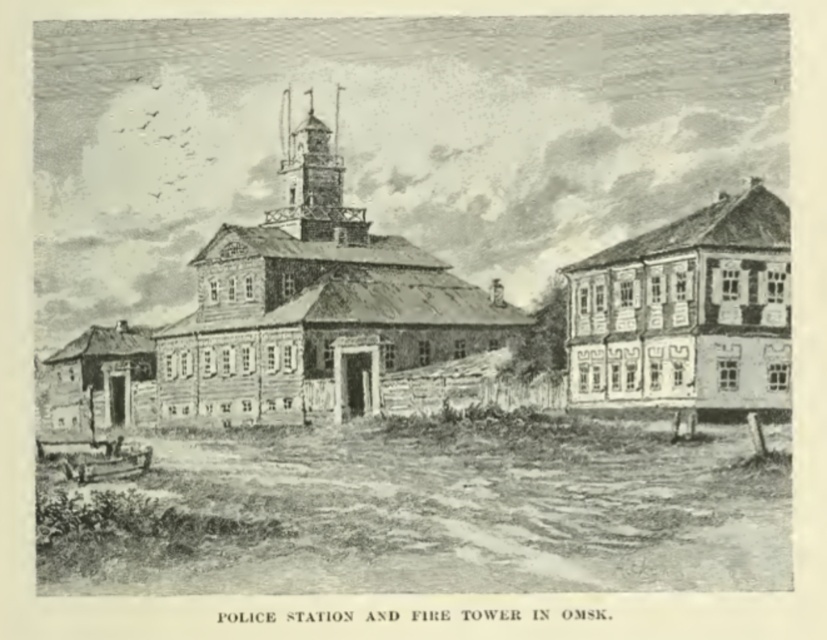
Who is taller, wooden tower at center or wooden house at right?

Standing taller between the two is wooden tower at center.

Is wooden tower at center wider than wooden house at right?

Correct, the width of wooden tower at center exceeds that of wooden house at right.

Who is more forward, (290, 168) or (708, 340)?

Point (708, 340) is in front.

At what (x,y) coordinates should I click in order to perform the action: click on wooden tower at center. Please return your answer as a coordinate pair (x, y). Image resolution: width=827 pixels, height=640 pixels. Looking at the image, I should click on (314, 307).